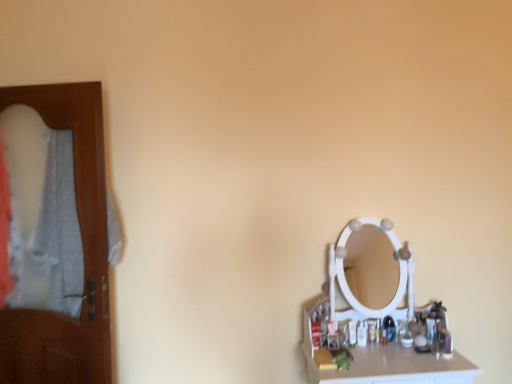
Question: Considering the relative sizes of brown wooden door at left and translucent plastic bottle at right in the image provided, is brown wooden door at left shorter than translucent plastic bottle at right?

Choices:
 (A) no
 (B) yes

Answer: (A)

Question: Is brown wooden door at left smaller than translucent plastic bottle at right?

Choices:
 (A) no
 (B) yes

Answer: (A)

Question: Is brown wooden door at left further to the viewer compared to translucent plastic bottle at right?

Choices:
 (A) no
 (B) yes

Answer: (A)

Question: Is brown wooden door at left wider than translucent plastic bottle at right?

Choices:
 (A) yes
 (B) no

Answer: (A)

Question: Are brown wooden door at left and translucent plastic bottle at right far apart?

Choices:
 (A) yes
 (B) no

Answer: (A)

Question: Is translucent plastic bottle at right in front of or behind white glossy counter top at lower right in the image?

Choices:
 (A) front
 (B) behind

Answer: (B)

Question: Considering the positions of translucent plastic bottle at right and white glossy counter top at lower right in the image, is translucent plastic bottle at right wider or thinner than white glossy counter top at lower right?

Choices:
 (A) thin
 (B) wide

Answer: (A)

Question: Considering the positions of translucent plastic bottle at right and white glossy counter top at lower right in the image, is translucent plastic bottle at right taller or shorter than white glossy counter top at lower right?

Choices:
 (A) short
 (B) tall

Answer: (A)

Question: From a real-world perspective, is translucent plastic bottle at right positioned above or below white glossy counter top at lower right?

Choices:
 (A) below
 (B) above

Answer: (B)

Question: From a real-world perspective, is white glossy counter top at lower right physically located above or below brown wooden door at left?

Choices:
 (A) above
 (B) below

Answer: (B)

Question: From their relative heights in the image, would you say white glossy counter top at lower right is taller or shorter than brown wooden door at left?

Choices:
 (A) short
 (B) tall

Answer: (A)

Question: In the image, is white glossy counter top at lower right positioned in front of or behind brown wooden door at left?

Choices:
 (A) behind
 (B) front

Answer: (B)

Question: Looking at their shapes, would you say white glossy counter top at lower right is wider or thinner than brown wooden door at left?

Choices:
 (A) thin
 (B) wide

Answer: (B)

Question: In terms of size, does brown wooden door at left appear bigger or smaller than translucent plastic bottle at right?

Choices:
 (A) big
 (B) small

Answer: (A)

Question: Considering the positions of point (102, 329) and point (351, 344), is point (102, 329) closer or farther from the camera than point (351, 344)?

Choices:
 (A) closer
 (B) farther

Answer: (A)